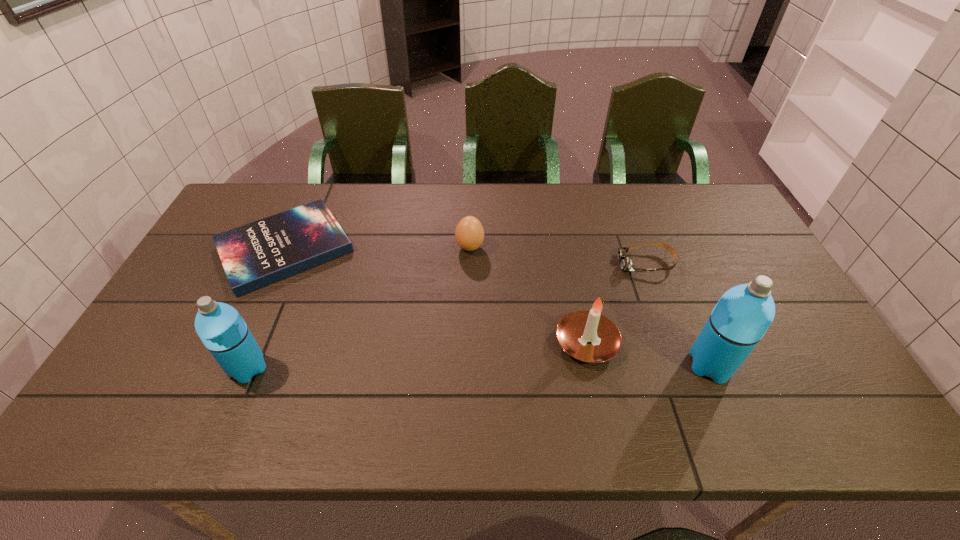
Where is `free spot that satisfies the following two spatial constraints: 1. on the front side of the shortest object; 2. on the right side of the right thermos bottle`? Image resolution: width=960 pixels, height=540 pixels. free spot that satisfies the following two spatial constraints: 1. on the front side of the shortest object; 2. on the right side of the right thermos bottle is located at coordinates (231, 365).

I want to click on free spot that satisfies the following two spatial constraints: 1. on the back side of the boiled egg; 2. on the right side of the fifth shortest object, so click(300, 247).